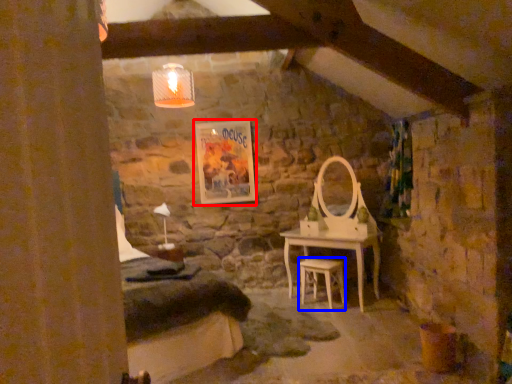
Question: Which of the following is the farthest to the observer, picture frame (highlighted by a red box) or stool (highlighted by a blue box)?

Choices:
 (A) picture frame
 (B) stool

Answer: (A)